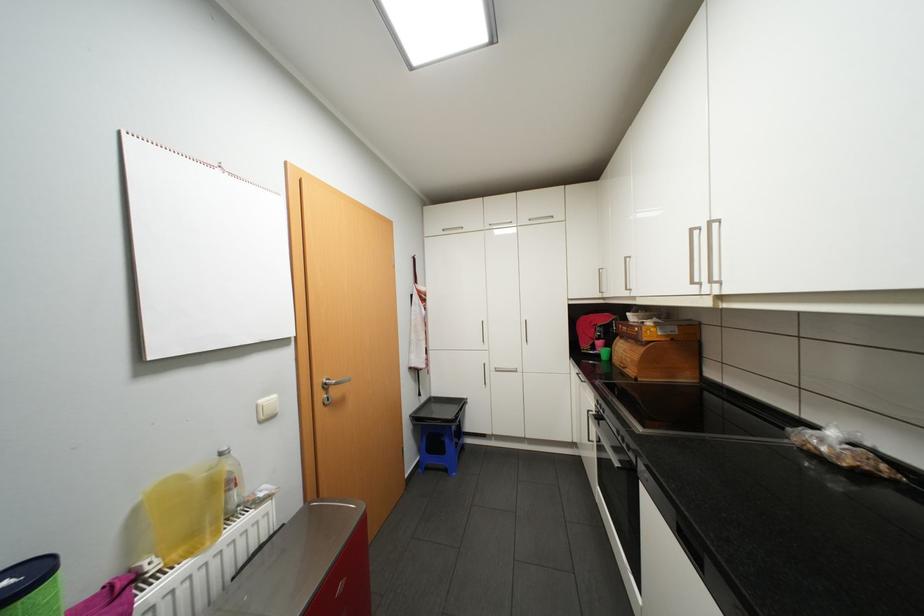
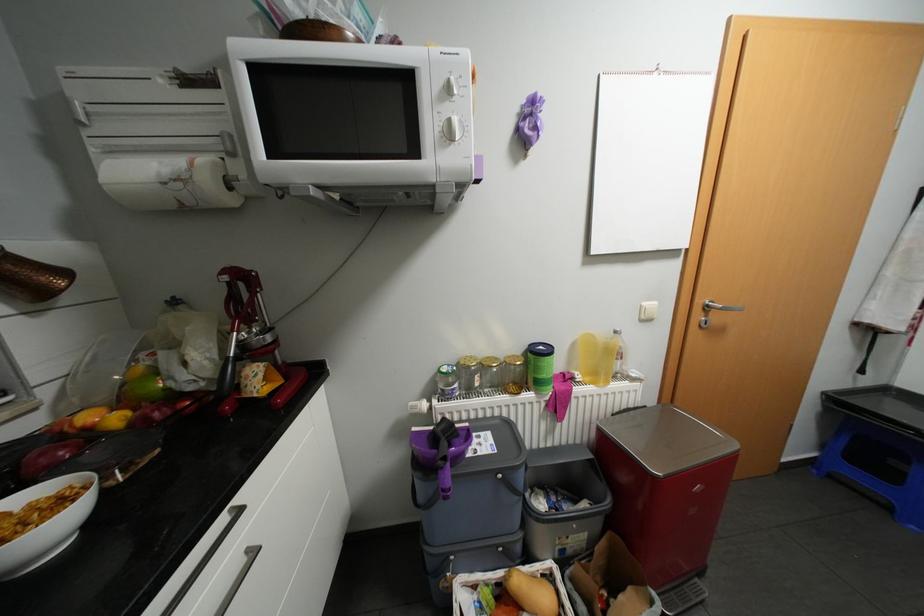
Find the pixel in the second image that matches point (334, 383) in the first image.

(715, 305)